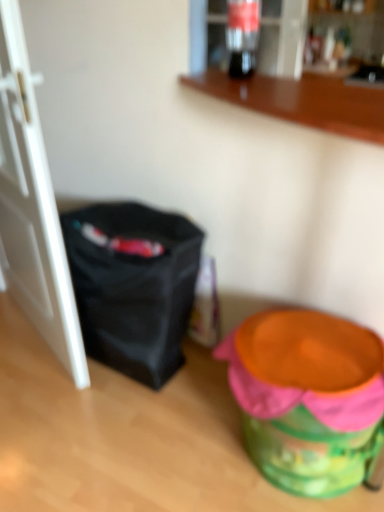
Locate an element on the screen. free space in front of translucent glass soda at upper center is located at coordinates (251, 82).